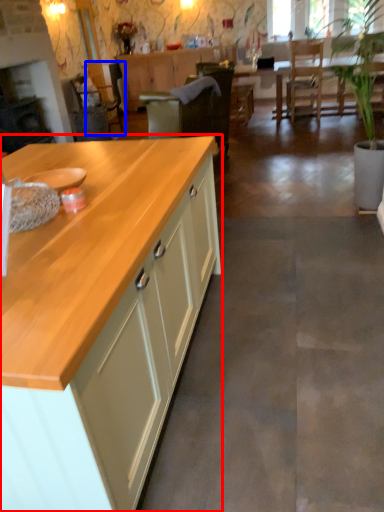
Question: Among these objects, which one is nearest to the camera, cabinetry (highlighted by a red box) or armchair (highlighted by a blue box)?

Choices:
 (A) cabinetry
 (B) armchair

Answer: (A)